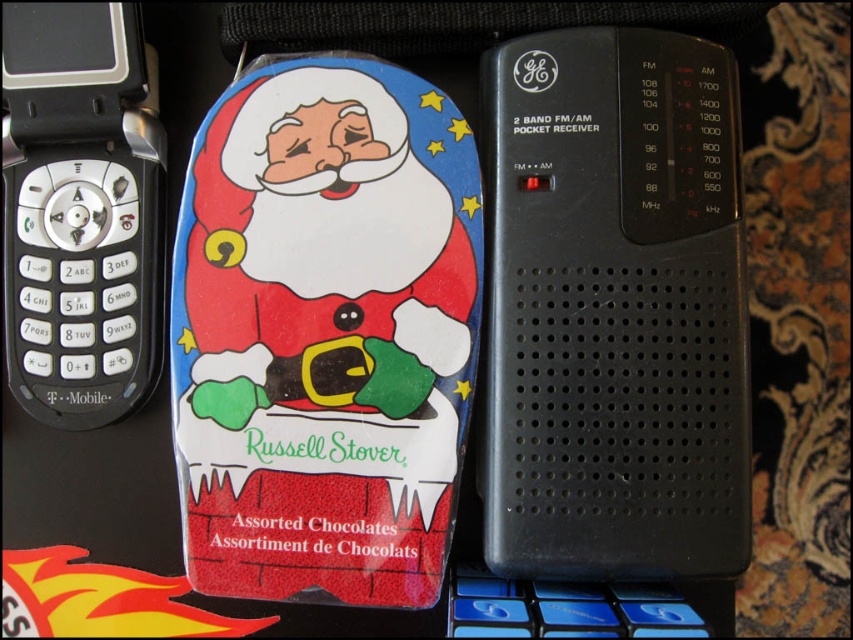
Is glossy plastic santa claus at center taller than black plastic radio at center right?

Indeed, glossy plastic santa claus at center has a greater height compared to black plastic radio at center right.

Describe the element at coordinates (323, 333) in the screenshot. I see `glossy plastic santa claus at center` at that location.

Is point (438, 465) positioned before point (662, 116)?

Yes, it is.

Find the location of a particular element. The height and width of the screenshot is (640, 853). glossy plastic santa claus at center is located at coordinates (323, 333).

Which of these two, black plastic radio at center right or black plastic flip phone at left, stands taller?

black plastic radio at center right is taller.

Is black plastic radio at center right smaller than black plastic flip phone at left?

No.

Between point (482, 465) and point (44, 12), which one is positioned in front?

Point (44, 12)

Identify the location of black plastic radio at center right. (613, 308).

Is glossy plastic santa claus at center below black plastic flip phone at left?

Correct, glossy plastic santa claus at center is located below black plastic flip phone at left.

Is glossy plastic santa claus at center taller than black plastic flip phone at left?

Correct, glossy plastic santa claus at center is much taller as black plastic flip phone at left.

The width and height of the screenshot is (853, 640). What do you see at coordinates (323, 333) in the screenshot? I see `glossy plastic santa claus at center` at bounding box center [323, 333].

Where is `glossy plastic santa claus at center`? glossy plastic santa claus at center is located at coordinates (323, 333).